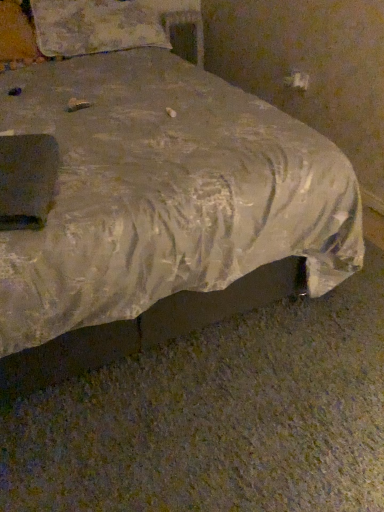
Question: Should I look upward or downward to see white fabric pillow at upper left?

Choices:
 (A) up
 (B) down

Answer: (A)

Question: Would you say white fabric pillow at upper left is outside silvery fabric bed at center?

Choices:
 (A) no
 (B) yes

Answer: (A)

Question: Is white fabric pillow at upper left surrounding silvery fabric bed at center?

Choices:
 (A) no
 (B) yes

Answer: (A)

Question: Is white fabric pillow at upper left wider than silvery fabric bed at center?

Choices:
 (A) no
 (B) yes

Answer: (A)

Question: From a real-world perspective, is white fabric pillow at upper left located beneath silvery fabric bed at center?

Choices:
 (A) yes
 (B) no

Answer: (B)

Question: Is white fabric pillow at upper left positioned far away from silvery fabric bed at center?

Choices:
 (A) yes
 (B) no

Answer: (B)

Question: Are white fabric pillow at upper left and silvery fabric bed at center making contact?

Choices:
 (A) yes
 (B) no

Answer: (B)

Question: Does silvery fabric bed at center have a smaller size compared to white fabric pillow at upper left?

Choices:
 (A) no
 (B) yes

Answer: (A)

Question: Is the depth of silvery fabric bed at center greater than that of white fabric pillow at upper left?

Choices:
 (A) no
 (B) yes

Answer: (A)

Question: Considering the relative sizes of silvery fabric bed at center and white fabric pillow at upper left in the image provided, is silvery fabric bed at center wider than white fabric pillow at upper left?

Choices:
 (A) no
 (B) yes

Answer: (B)

Question: Considering the relative sizes of silvery fabric bed at center and white fabric pillow at upper left in the image provided, is silvery fabric bed at center taller than white fabric pillow at upper left?

Choices:
 (A) no
 (B) yes

Answer: (B)

Question: Is silvery fabric bed at center thinner than white fabric pillow at upper left?

Choices:
 (A) yes
 (B) no

Answer: (B)

Question: Does silvery fabric bed at center appear on the right side of white fabric pillow at upper left?

Choices:
 (A) no
 (B) yes

Answer: (B)

Question: Is white fabric pillow at upper left situated inside silvery fabric bed at center or outside?

Choices:
 (A) inside
 (B) outside

Answer: (A)